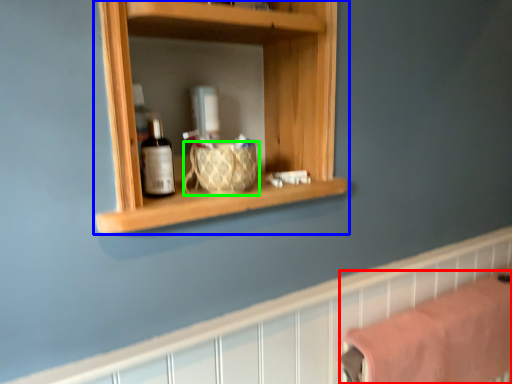
Question: Which object is the closest to the bath towel (highlighted by a red box)? Choose among these: shelf (highlighted by a blue box) or basket (highlighted by a green box).

Choices:
 (A) shelf
 (B) basket

Answer: (A)